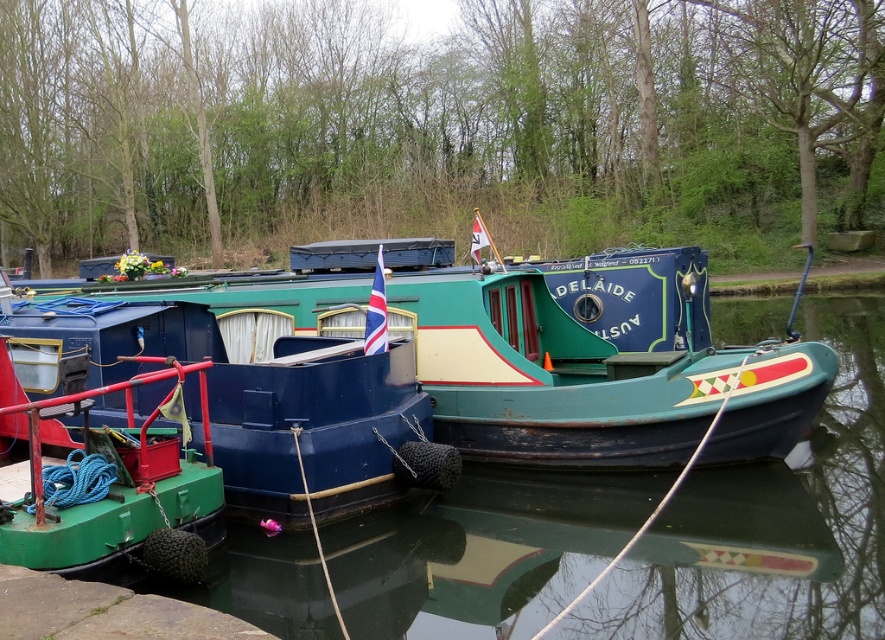
Question: Among these objects, which one is farthest from the camera?

Choices:
 (A) brown stone dock at lower left
 (B) matte blue boat at center
 (C) teal wooden boat at center
 (D) green matte boat at left

Answer: (C)

Question: Which of the following is the farthest from the observer?

Choices:
 (A) brown stone dock at lower left
 (B) matte blue boat at center

Answer: (B)

Question: Which object appears farthest from the camera in this image?

Choices:
 (A) brown stone dock at lower left
 (B) green matte boat at left

Answer: (B)

Question: Can you confirm if matte blue boat at center is bigger than green matte boat at left?

Choices:
 (A) yes
 (B) no

Answer: (A)

Question: In this image, where is matte blue boat at center located relative to brown stone dock at lower left?

Choices:
 (A) left
 (B) right

Answer: (A)

Question: Can you confirm if teal wooden boat at center is bigger than green matte boat at left?

Choices:
 (A) yes
 (B) no

Answer: (A)